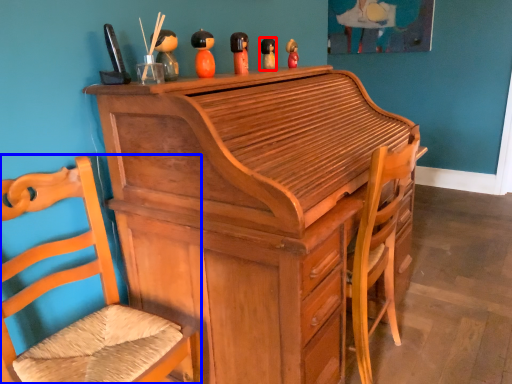
Question: Which point is further to the camera, toy (highlighted by a red box) or chair (highlighted by a blue box)?

Choices:
 (A) toy
 (B) chair

Answer: (A)